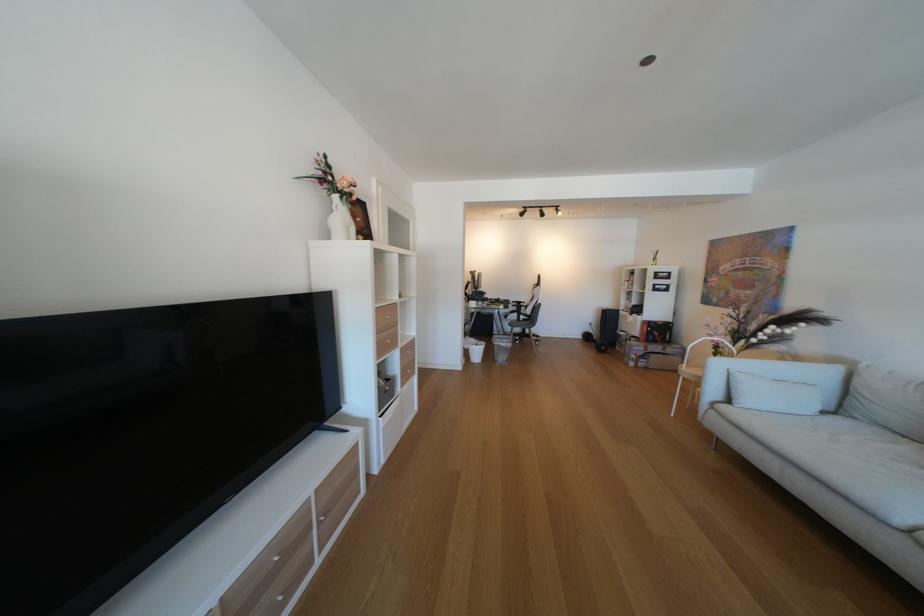
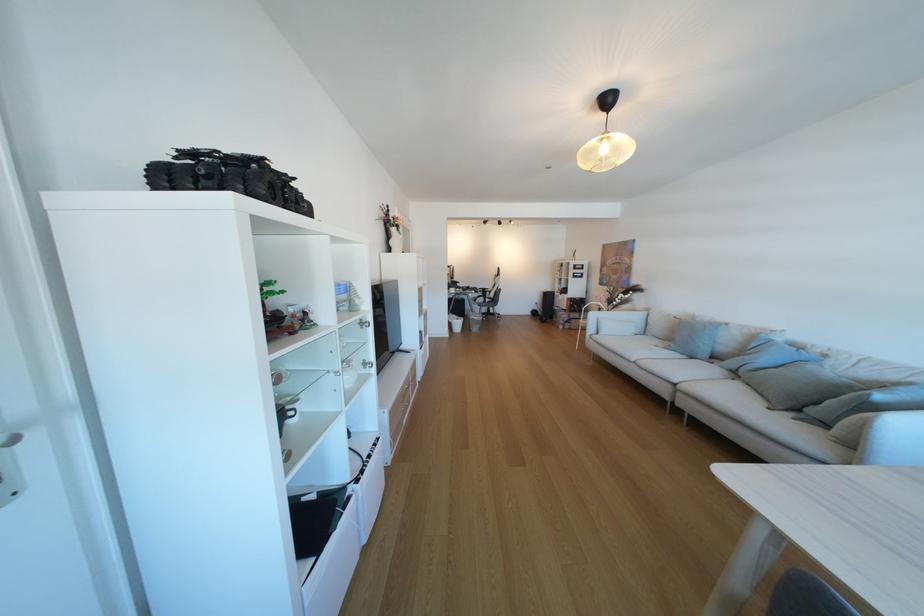
In the second image, find the point that corresponds to pixel 513 342 in the first image.

(485, 317)